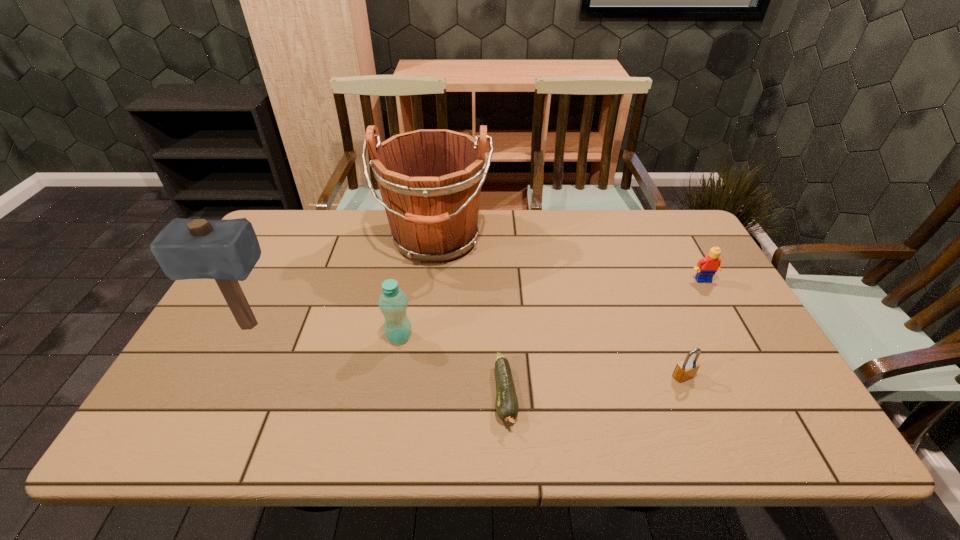
Locate an element on the screen. The image size is (960, 540). vacant space at the right edge of the desktop is located at coordinates (658, 255).

The image size is (960, 540). Identify the location of vacant position at the far left corner of the desktop. [x=307, y=241].

The image size is (960, 540). In the image, there is a desktop. What are the coordinates of `free space at the far right corner` in the screenshot? It's located at (675, 232).

This screenshot has width=960, height=540. In order to click on vacant space at the near right corner of the desktop in this screenshot , I will do `click(782, 414)`.

In order to click on vacant space in between the leftmost object and the shortest object in this screenshot , I will do `click(376, 360)`.

Where is `free spot between the fourth tallest object and the second object from right to left`? Image resolution: width=960 pixels, height=540 pixels. free spot between the fourth tallest object and the second object from right to left is located at coordinates (693, 328).

Where is `vacant space that's between the mallet and the shortest object`? Image resolution: width=960 pixels, height=540 pixels. vacant space that's between the mallet and the shortest object is located at coordinates (376, 360).

Image resolution: width=960 pixels, height=540 pixels. Find the location of `vacant area that lies between the bucket and the rightmost object`. vacant area that lies between the bucket and the rightmost object is located at coordinates (569, 260).

In order to click on free space between the rightmost object and the padlock in this screenshot , I will do `click(693, 328)`.

Where is `vacant area that lies between the fifth tallest object and the bucket`? Image resolution: width=960 pixels, height=540 pixels. vacant area that lies between the fifth tallest object and the bucket is located at coordinates (560, 308).